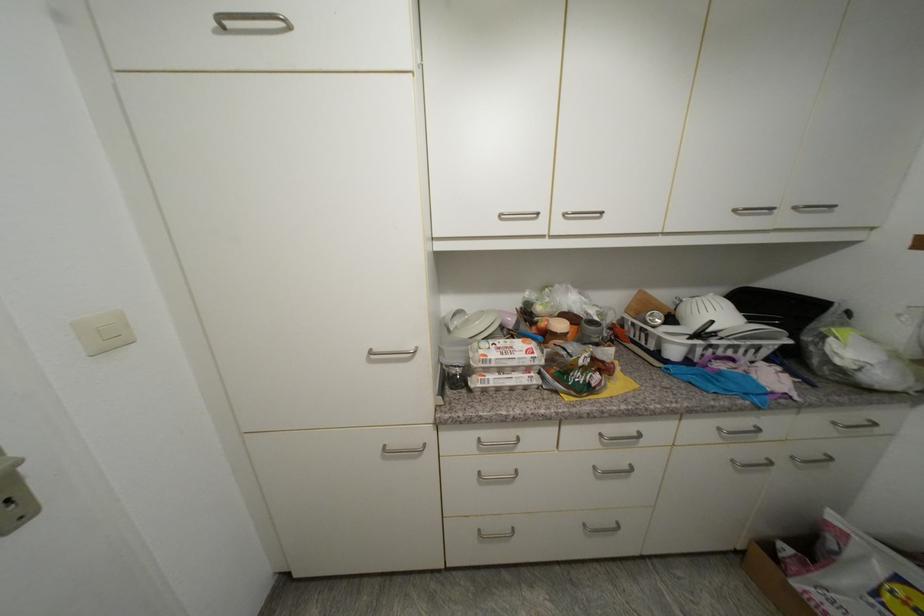
In order to click on clear plastic container in this screenshot , I will do `click(349, 517)`.